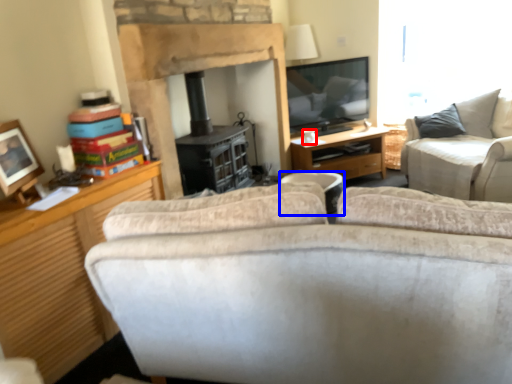
Question: Which point is closer to the camera, coffee cup (highlighted by a red box) or trash bin/can (highlighted by a blue box)?

Choices:
 (A) coffee cup
 (B) trash bin/can

Answer: (B)